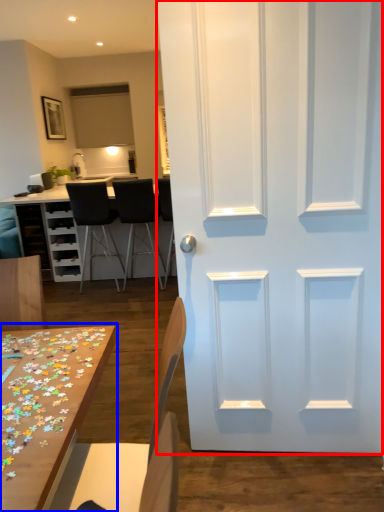
Question: Which of the following is the farthest to the observer, door (highlighted by a red box) or table (highlighted by a blue box)?

Choices:
 (A) door
 (B) table

Answer: (A)